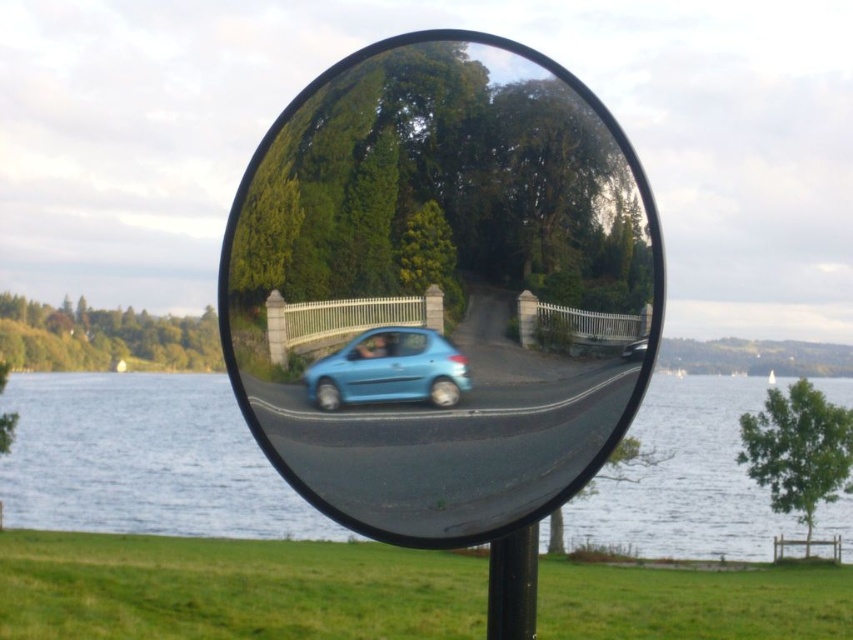
Between smooth glass mirror at center and blue glossy car at center, which one appears on the left side from the viewer's perspective?

blue glossy car at center is more to the left.

Is smooth glass mirror at center to the left of blue glossy car at center from the viewer's perspective?

No, smooth glass mirror at center is not to the left of blue glossy car at center.

Between point (262, 333) and point (368, 349), which one is positioned in front?

Positioned in front is point (368, 349).

Where is `smooth glass mirror at center`? The width and height of the screenshot is (853, 640). smooth glass mirror at center is located at coordinates (440, 289).

Can you confirm if blue water at mirror center is bigger than light blue matte car at center?

Yes, blue water at mirror center is bigger than light blue matte car at center.

Can you confirm if blue water at mirror center is positioned to the right of light blue matte car at center?

Incorrect, blue water at mirror center is not on the right side of light blue matte car at center.

Which is in front, point (735, 444) or point (444, 360)?

Point (444, 360)

Image resolution: width=853 pixels, height=640 pixels. I want to click on blue water at mirror center, so click(x=143, y=460).

Can you confirm if smooth glass mirror at center is positioned above light blue matte car at center?

Indeed, smooth glass mirror at center is positioned over light blue matte car at center.

From the picture: Between smooth glass mirror at center and light blue matte car at center, which one appears on the right side from the viewer's perspective?

Positioned to the right is smooth glass mirror at center.

The height and width of the screenshot is (640, 853). In order to click on smooth glass mirror at center in this screenshot , I will do pyautogui.click(x=440, y=289).